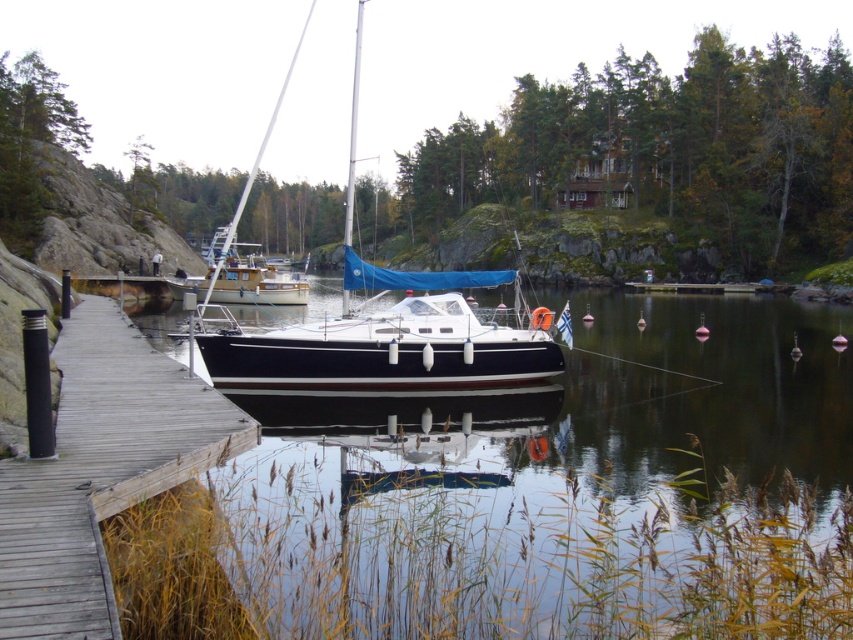
Question: Which object is the closest to the wooden dock at center?

Choices:
 (A) clear water at center
 (B) black glossy sailboat at center

Answer: (A)

Question: Is wooden dock at center bigger than black glossy sailboat at center?

Choices:
 (A) yes
 (B) no

Answer: (B)

Question: In this image, where is clear water at center located relative to wooden dock at center?

Choices:
 (A) left
 (B) right

Answer: (B)

Question: Which point is farther from the camera taking this photo?

Choices:
 (A) (209, 458)
 (B) (664, 324)

Answer: (B)

Question: Which is nearer to the black glossy sailboat at center?

Choices:
 (A) clear water at center
 (B) wooden dock at center

Answer: (A)

Question: Where is clear water at center located in relation to black glossy sailboat at center in the image?

Choices:
 (A) above
 (B) below

Answer: (B)